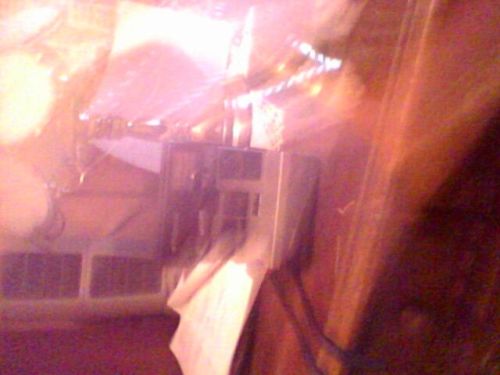
Locate an element on the screen. Image resolution: width=500 pixels, height=375 pixels. glaring light is located at coordinates (267, 128), (213, 312), (187, 92), (34, 111), (137, 147).